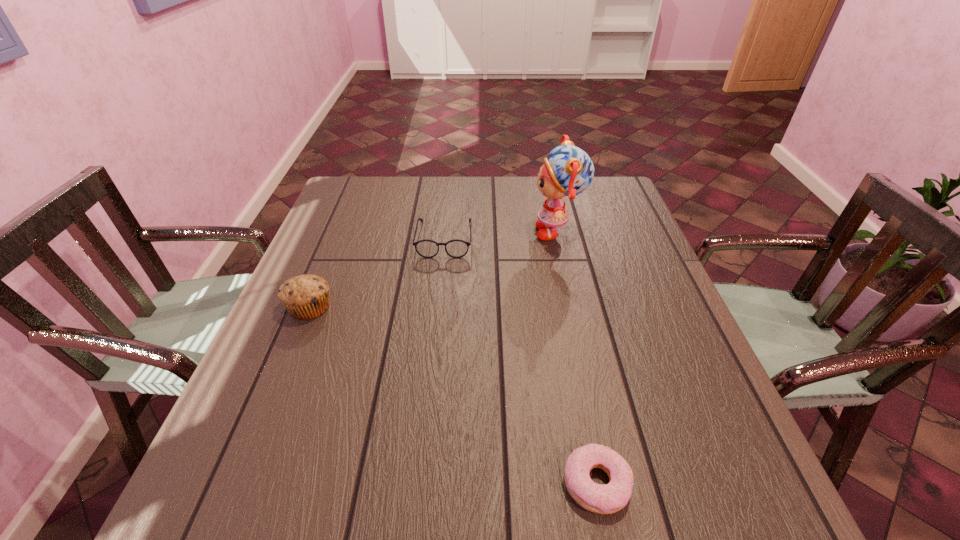
The width and height of the screenshot is (960, 540). What are the coordinates of `the tallest object` in the screenshot? It's located at coord(568,171).

This screenshot has width=960, height=540. Identify the location of the leftmost object. (305, 297).

Locate an element on the screen. the second tallest object is located at coordinates (305, 297).

Where is `the third object from right to left`? Image resolution: width=960 pixels, height=540 pixels. the third object from right to left is located at coordinates (426, 248).

This screenshot has height=540, width=960. In order to click on the second shortest object in this screenshot , I will do click(x=426, y=248).

Where is `doughnut`? Image resolution: width=960 pixels, height=540 pixels. doughnut is located at coordinates (603, 499).

Where is `the shortest object`? The height and width of the screenshot is (540, 960). the shortest object is located at coordinates (603, 499).

In order to click on free region located on the face of the tallest object in this screenshot , I will do `click(477, 232)`.

Image resolution: width=960 pixels, height=540 pixels. In order to click on vacant region located on the face of the tallest object in this screenshot , I will do `click(452, 232)`.

This screenshot has height=540, width=960. What are the coordinates of `vacant space situated 0.210m on the face of the tallest object` in the screenshot? It's located at (459, 232).